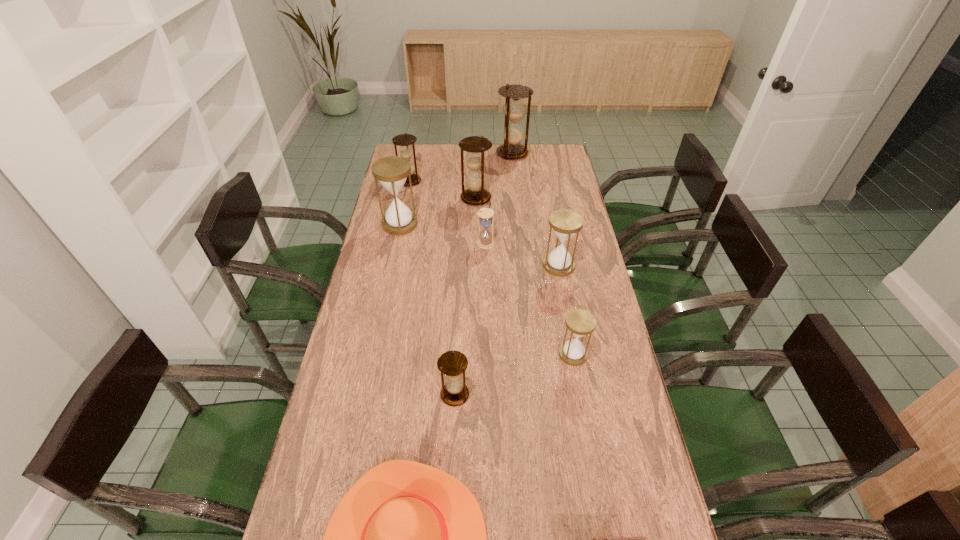
At what (x,y) coordinates should I click in order to perform the action: click on free area in between the second biggest brown hourglass and the nearest brown hourglass. Please return your answer as a coordinate pair (x, y). This screenshot has width=960, height=540. Looking at the image, I should click on (466, 296).

Locate which object is the fifth closest to the fifth nearest object. Please provide its 2D coordinates. Your answer should be formatted as a tuple, i.e. [(x, y)], where the tuple contains the x and y coordinates of a point satisfying the conditions above.

[(452, 364)]

At what (x,y) coordinates should I click in order to perform the action: click on object that stands as the fifth closest to the cowboy hat. Please return your answer as a coordinate pair (x, y). The image size is (960, 540). Looking at the image, I should click on (485, 241).

Where is `hourglass that is the seventh closest to the farthest brown hourglass`? The height and width of the screenshot is (540, 960). hourglass that is the seventh closest to the farthest brown hourglass is located at coordinates (452, 364).

Locate an element on the screen. the fifth closest hourglass to the farthest object is located at coordinates (565, 223).

Select which brown hourglass is the second closest to the sixth farthest hourglass. Please provide its 2D coordinates. Your answer should be formatted as a tuple, i.e. [(x, y)], where the tuple contains the x and y coordinates of a point satisfying the conditions above.

[(452, 364)]

Select which brown hourglass appears as the third closest to the eighth farthest object. Please provide its 2D coordinates. Your answer should be formatted as a tuple, i.e. [(x, y)], where the tuple contains the x and y coordinates of a point satisfying the conditions above.

[(515, 109)]

The width and height of the screenshot is (960, 540). Identify the location of white hourglass that is the second closest to the smallest brown hourglass. (565, 223).

Locate which white hourglass ranks third in proximity to the second farthest brown hourglass. Please provide its 2D coordinates. Your answer should be formatted as a tuple, i.e. [(x, y)], where the tuple contains the x and y coordinates of a point satisfying the conditions above.

[(565, 223)]

Locate an element on the screen. vacant space that satisfies the following two spatial constraints: 1. on the back side of the nearest brown hourglass; 2. on the right side of the farthest hourglass is located at coordinates click(466, 153).